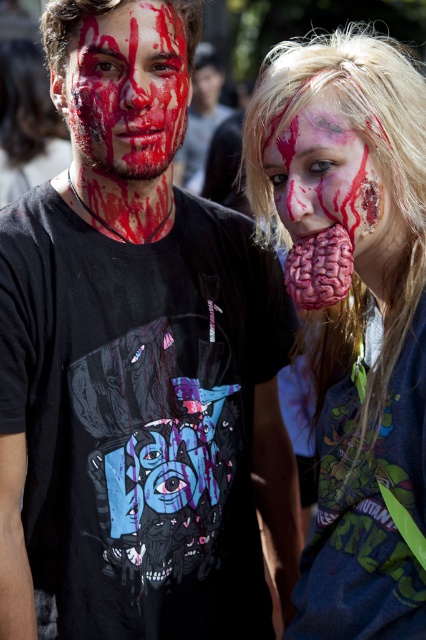
Question: Is matte black t-shirt at left positioned before matte red paint at center?

Choices:
 (A) no
 (B) yes

Answer: (B)

Question: Estimate the real-world distances between objects in this image. Which object is farther from the matte black t-shirt at left?

Choices:
 (A) matte red paint at center
 (B) rubber brain at center

Answer: (B)

Question: Which point is farther to the camera?

Choices:
 (A) (336, 216)
 (B) (186, 208)
 (C) (394, 198)
 (D) (132, 84)

Answer: (B)

Question: Is rubber brain at center to the left of matte red paint at center from the viewer's perspective?

Choices:
 (A) no
 (B) yes

Answer: (A)

Question: Which of the following is the closest to the observer?

Choices:
 (A) (371, 196)
 (B) (57, 390)

Answer: (A)

Question: Can you confirm if rubber brain at center is positioned to the left of bloodied plastic brain at center?

Choices:
 (A) no
 (B) yes

Answer: (A)